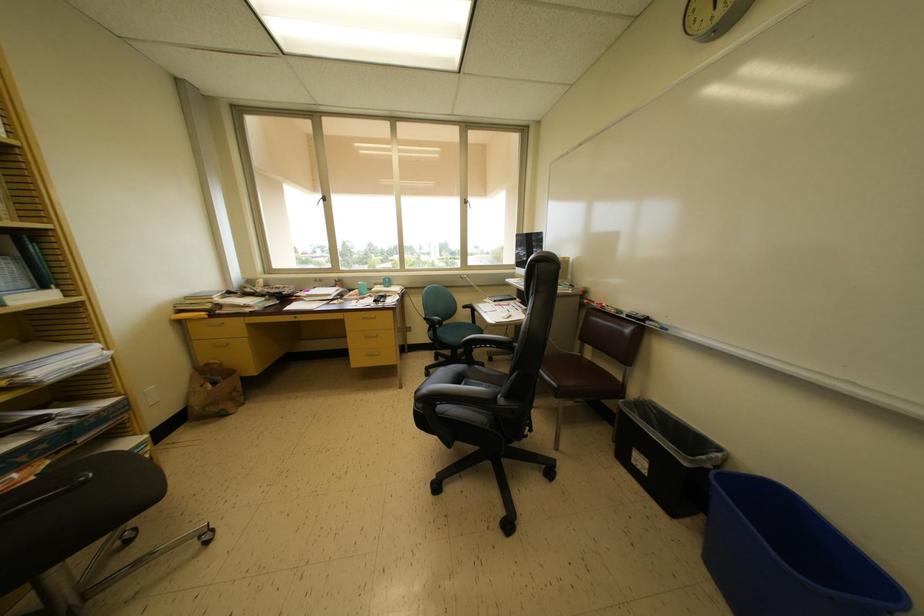
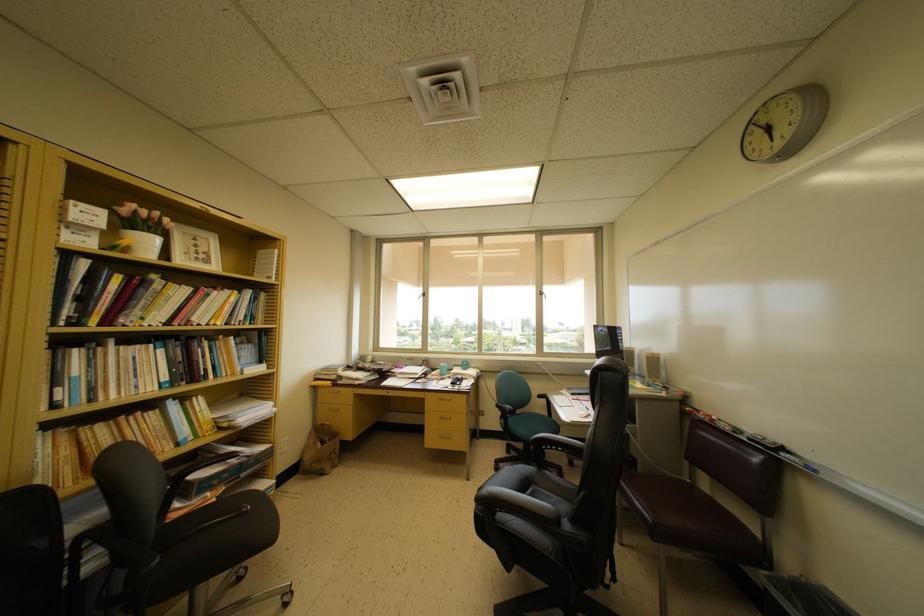
In the second image, find the point that corresponds to [651,323] in the first image.

(786, 454)